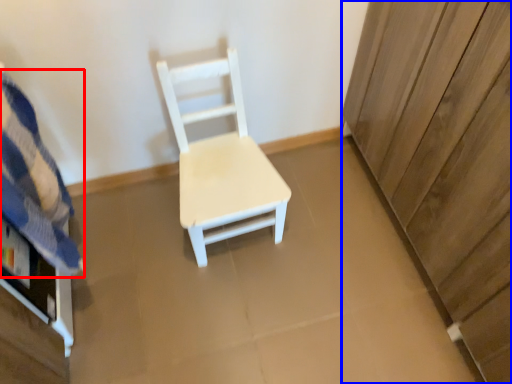
Question: Which of the following is the farthest to the observer, bedding (highlighted by a red box) or dresser (highlighted by a blue box)?

Choices:
 (A) bedding
 (B) dresser

Answer: (A)